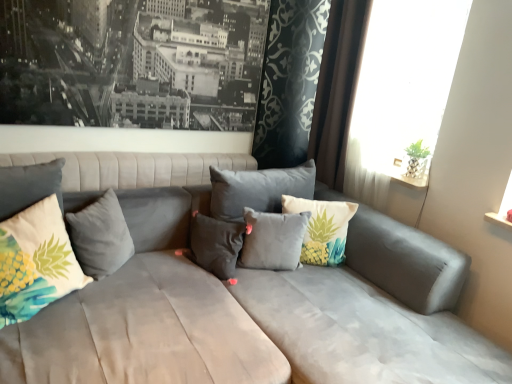
Question: Considering the relative positions of printed fabric pineapple pillow at left, placed as the 1th pillow when sorted from left to right, and pineapple-patterned fabric pillow at center, placed as the 1th pillow when sorted from right to left, in the image provided, is printed fabric pineapple pillow at left, placed as the 1th pillow when sorted from left to right, to the left or to the right of pineapple-patterned fabric pillow at center, placed as the 1th pillow when sorted from right to left,?

Choices:
 (A) right
 (B) left

Answer: (B)

Question: Relative to pineapple-patterned fabric pillow at center, which is counted as the 5th pillow, starting from the left, is printed fabric pineapple pillow at left, placed as the 1th pillow when sorted from left to right, in front or behind?

Choices:
 (A) front
 (B) behind

Answer: (A)

Question: Considering the real-world distances, which object is farthest from the pineapple-patterned fabric pillow at center, which is counted as the 5th pillow, starting from the left?

Choices:
 (A) velvet gray pillow at center, placed as the 3th pillow when sorted from left to right
 (B) suede gray couch at center
 (C) black matte picture frame at upper left
 (D) white sheer curtain at upper right
 (E) brown velvet curtain at upper right

Answer: (C)

Question: Which object is positioned closest to the gray matte pillow at center, which appears as the second pillow when viewed from the right?

Choices:
 (A) black matte picture frame at upper left
 (B) velvet gray pillow at center, placed as the 3th pillow when sorted from left to right
 (C) printed fabric pineapple pillow at left, placed as the 1th pillow when sorted from left to right
 (D) brown velvet curtain at upper right
 (E) white sheer curtain at upper right

Answer: (B)